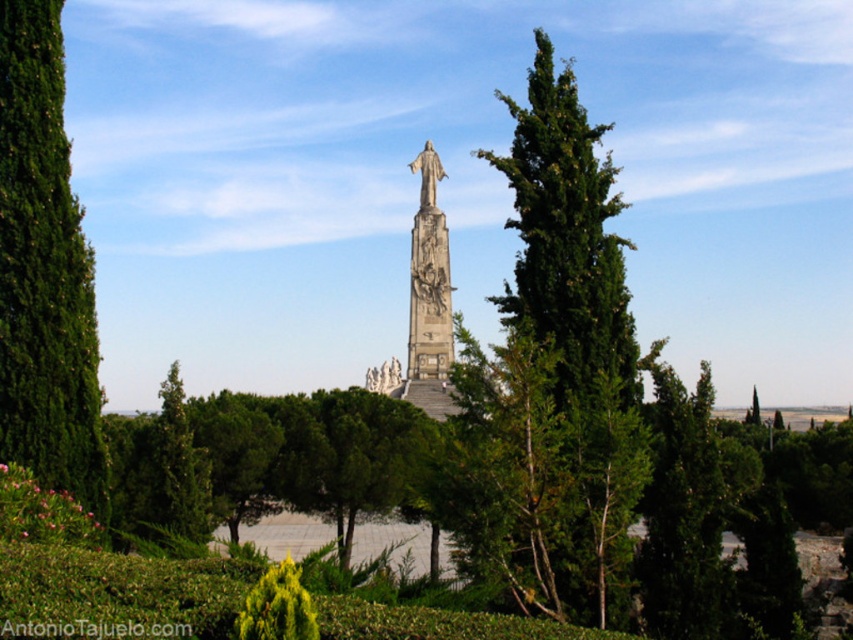
You are a visitor standing at the entrance of the monument area. You see the green textured tree at left and the stone statue at center. Which object is closer to you?

The green textured tree at left is closer to you because it is in front of the stone statue at center.

You are standing at the center of the monument area and want to locate the green textured tree at left. According to the coordinates provided, in which direction should you look to find it?

The green textured tree at left is located at coordinates point (44, 269), which means you should look to the left side of the monument area to find it.

You are a landscape architect planning to add a new pathway between the green textured tree at left and the stone statue at center. Considering their heights, which object might cast a longer shadow at noon, potentially affecting the pathway design?

The green textured tree at left is much taller than the stone statue at center, so it will cast a longer shadow at noon, which could affect the pathway design.